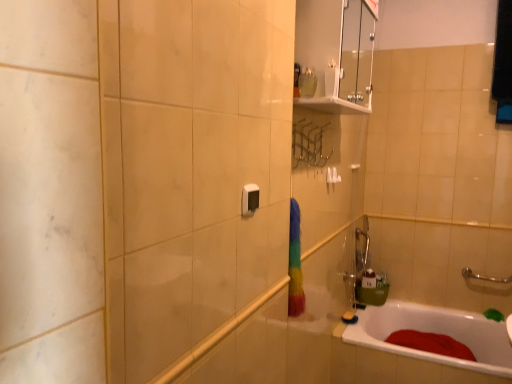
Question: Could you tell me if white plastic towel bar at upper center is turned towards white glossy bathtub at lower right?

Choices:
 (A) no
 (B) yes

Answer: (A)

Question: From a real-world perspective, is white plastic towel bar at upper center located beneath white glossy bathtub at lower right?

Choices:
 (A) no
 (B) yes

Answer: (A)

Question: Is white plastic towel bar at upper center completely or partially outside of white glossy bathtub at lower right?

Choices:
 (A) yes
 (B) no

Answer: (A)

Question: Considering the relative positions of white plastic towel bar at upper center and white glossy bathtub at lower right in the image provided, is white plastic towel bar at upper center behind white glossy bathtub at lower right?

Choices:
 (A) no
 (B) yes

Answer: (B)

Question: Is white plastic towel bar at upper center positioned far away from white glossy bathtub at lower right?

Choices:
 (A) no
 (B) yes

Answer: (B)

Question: Would you say white plastic towel bar at upper center is to the left or to the right of satin black switch at center in the picture?

Choices:
 (A) right
 (B) left

Answer: (A)

Question: Relative to satin black switch at center, is white plastic towel bar at upper center in front or behind?

Choices:
 (A) front
 (B) behind

Answer: (B)

Question: From the image's perspective, is white plastic towel bar at upper center positioned above or below satin black switch at center?

Choices:
 (A) below
 (B) above

Answer: (B)

Question: From a real-world perspective, is white plastic towel bar at upper center physically located above or below satin black switch at center?

Choices:
 (A) below
 (B) above

Answer: (A)

Question: Looking at the image, does white plastic towel bar at upper center seem bigger or smaller compared to transparent glass medicine cabinet at upper center?

Choices:
 (A) small
 (B) big

Answer: (A)

Question: Looking at their shapes, would you say white plastic towel bar at upper center is wider or thinner than transparent glass medicine cabinet at upper center?

Choices:
 (A) thin
 (B) wide

Answer: (A)

Question: Is white plastic towel bar at upper center taller or shorter than transparent glass medicine cabinet at upper center?

Choices:
 (A) tall
 (B) short

Answer: (B)

Question: From a real-world perspective, is white plastic towel bar at upper center above or below transparent glass medicine cabinet at upper center?

Choices:
 (A) above
 (B) below

Answer: (B)

Question: From a real-world perspective, relative to white plastic towel bar at upper center, is satin black switch at center vertically above or below?

Choices:
 (A) below
 (B) above

Answer: (B)

Question: Is satin black switch at center to the left or to the right of white plastic towel bar at upper center in the image?

Choices:
 (A) left
 (B) right

Answer: (A)